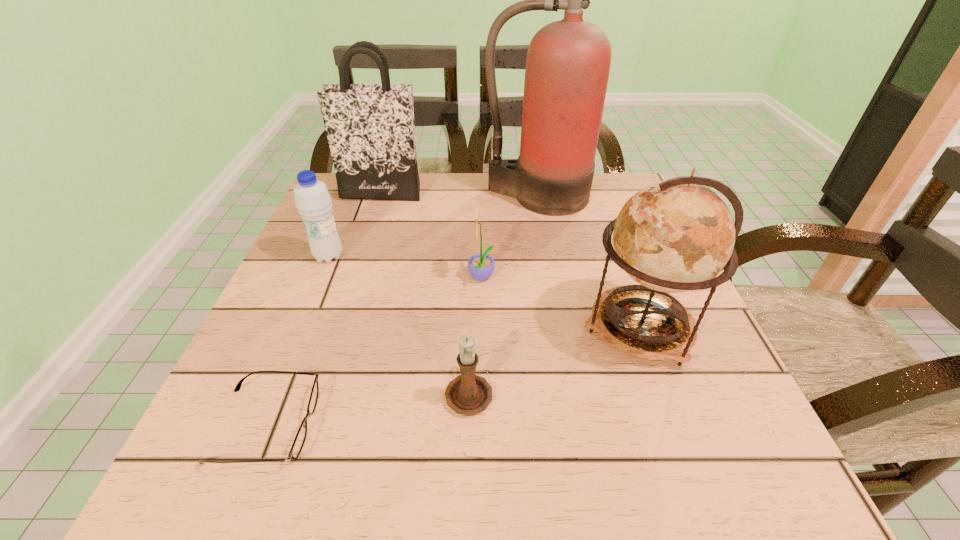
Find the location of a particular element. The height and width of the screenshot is (540, 960). object at the near left corner is located at coordinates (300, 437).

Identify the location of object located in the far right corner section of the desktop. (568, 62).

The height and width of the screenshot is (540, 960). In the image, there is a desktop. Identify the location of vacant space at the far edge. (439, 204).

Where is `free space at the left edge of the desktop`? Image resolution: width=960 pixels, height=540 pixels. free space at the left edge of the desktop is located at coordinates (347, 239).

Locate an element on the screen. This screenshot has width=960, height=540. free point at the right edge is located at coordinates (598, 223).

In order to click on vacant space that's between the shopping bag and the candle holder in this screenshot , I will do `click(424, 293)`.

The height and width of the screenshot is (540, 960). Identify the location of vacant space that's between the tallest object and the shortest object. (401, 310).

You are a GUI agent. You are given a task and a screenshot of the screen. Output one action in this format:
    pyautogui.click(x=<x>, y=<y>)
    Task: Click on the vacant area between the second shortest object and the globe
    
    Given the screenshot: What is the action you would take?
    click(x=554, y=360)

The width and height of the screenshot is (960, 540). I want to click on free point between the shortest object and the tallest object, so click(401, 310).

Image resolution: width=960 pixels, height=540 pixels. Find the location of `free space that is in between the tallest object and the sunflower`. free space that is in between the tallest object and the sunflower is located at coordinates (509, 237).